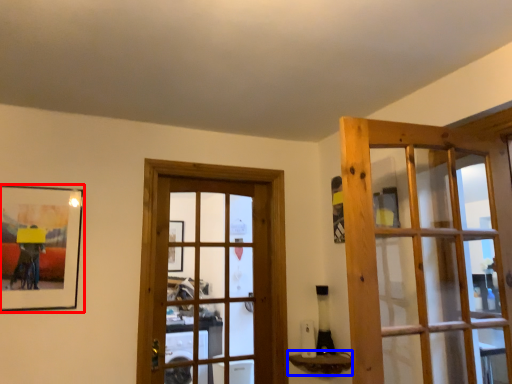
Question: Which object appears closest to the camera in this image, picture frame (highlighted by a red box) or window sill (highlighted by a blue box)?

Choices:
 (A) picture frame
 (B) window sill

Answer: (A)